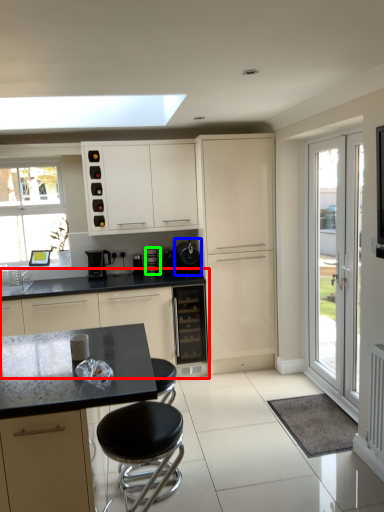
Question: Which is nearer to the cabinetry (highlighted by a red box)? appliance (highlighted by a blue box) or coffee machine (highlighted by a green box).

Choices:
 (A) appliance
 (B) coffee machine

Answer: (B)